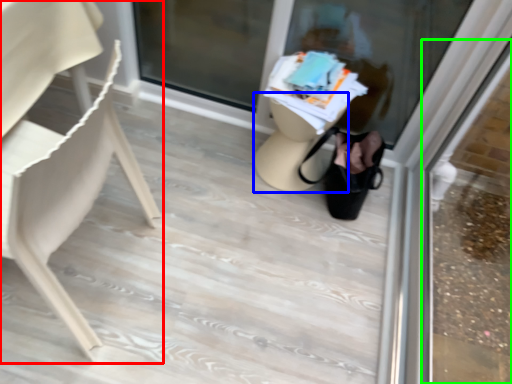
Question: Which object is the farthest from chair (highlighted by a red box)? Choose among these: table (highlighted by a blue box) or shop window (highlighted by a green box).

Choices:
 (A) table
 (B) shop window

Answer: (B)